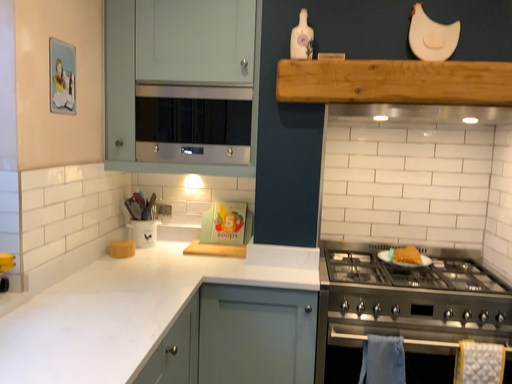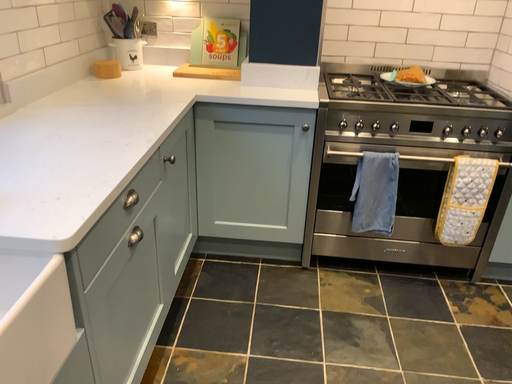
Question: How did the camera likely rotate when shooting the video?

Choices:
 (A) rotated upward
 (B) rotated downward

Answer: (B)